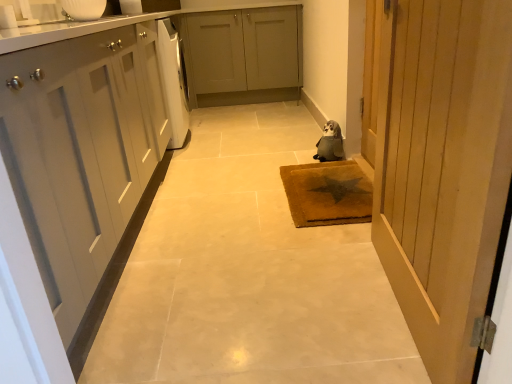
Question: Considering the positions of gray plush toy at center and wooden door at right in the image, is gray plush toy at center bigger or smaller than wooden door at right?

Choices:
 (A) small
 (B) big

Answer: (A)

Question: From a real-world perspective, relative to wooden door at right, is gray plush toy at center vertically above or below?

Choices:
 (A) above
 (B) below

Answer: (B)

Question: Which of these objects is positioned farthest from the white glossy dishwasher at left?

Choices:
 (A) matte gray cabinets at center, the first cabinetry when ordered from back to front
 (B) wooden door at right
 (C) white matte cabinet at left, marked as the 1th cabinetry in a front-to-back arrangement
 (D) gray plush toy at center
 (E) brown textured mat at center

Answer: (B)

Question: Estimate the real-world distances between objects in this image. Which object is closer to the matte gray cabinets at center, the 2th cabinetry ordered from the bottom?

Choices:
 (A) white matte cabinet at left, marked as the 1th cabinetry in a front-to-back arrangement
 (B) gray plush toy at center
 (C) white glossy dishwasher at left
 (D) wooden door at right
 (E) brown textured mat at center

Answer: (C)